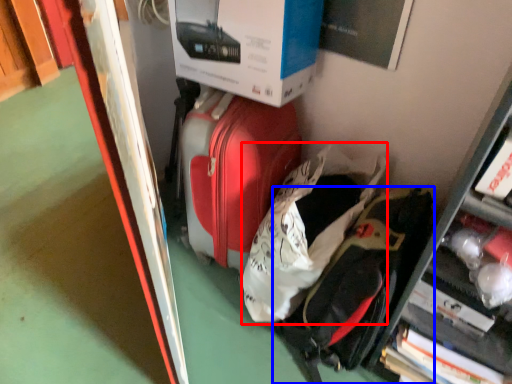
Question: Which object appears closest to the camera in this image, luggage (highlighted by a red box) or backpack (highlighted by a blue box)?

Choices:
 (A) luggage
 (B) backpack

Answer: (B)